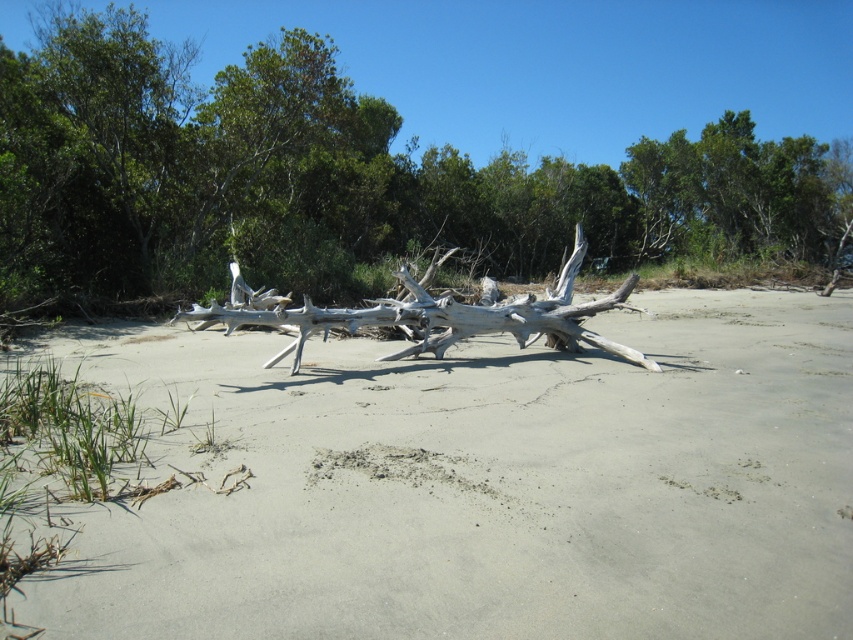
Question: Is gray sand at center further to camera compared to white driftwood at center?

Choices:
 (A) yes
 (B) no

Answer: (B)

Question: Which of the following is the farthest from the observer?

Choices:
 (A) (793, 392)
 (B) (210, 300)

Answer: (B)

Question: Which point is farther to the camera?

Choices:
 (A) (437, 323)
 (B) (761, 371)

Answer: (A)

Question: Estimate the real-world distances between objects in this image. Which object is closer to the gray driftwood at center?

Choices:
 (A) gray sand at center
 (B) white driftwood at center

Answer: (A)

Question: In this image, where is white driftwood at center located relative to gray driftwood at center?

Choices:
 (A) above
 (B) below

Answer: (A)

Question: Is gray sand at center behind gray driftwood at center?

Choices:
 (A) no
 (B) yes

Answer: (A)